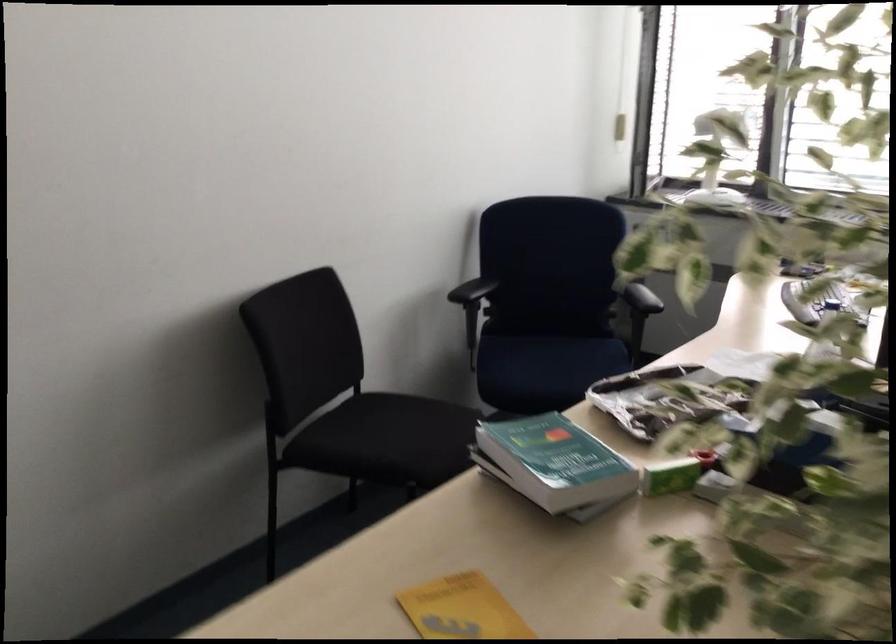
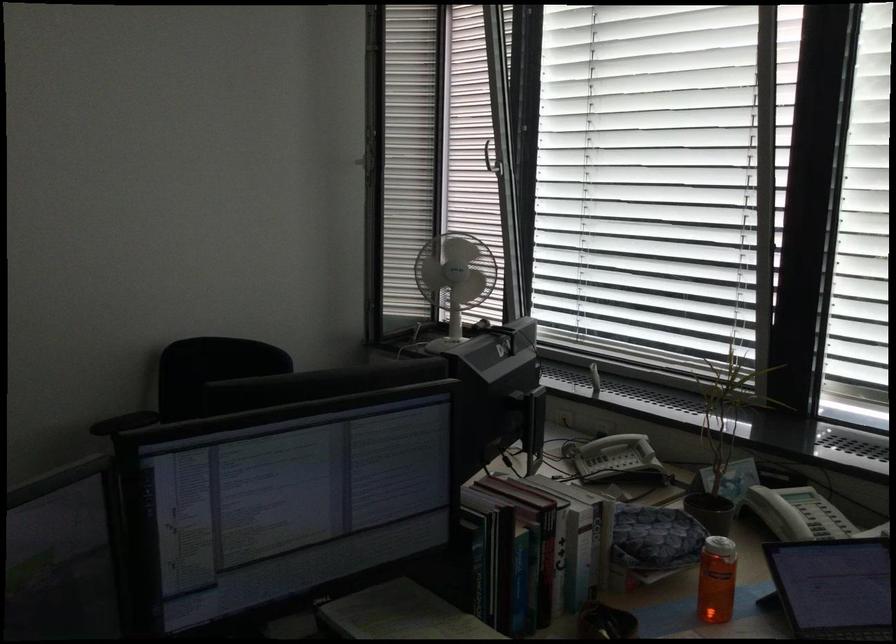
Question: I am providing you with two images of the same scene from different viewpoints. Which of the following objects are not visible in image2?

Choices:
 (A) white window handle
 (B) silver window handle
 (C) blue chair sitting surface
 (D) orange chair cushion

Answer: (C)